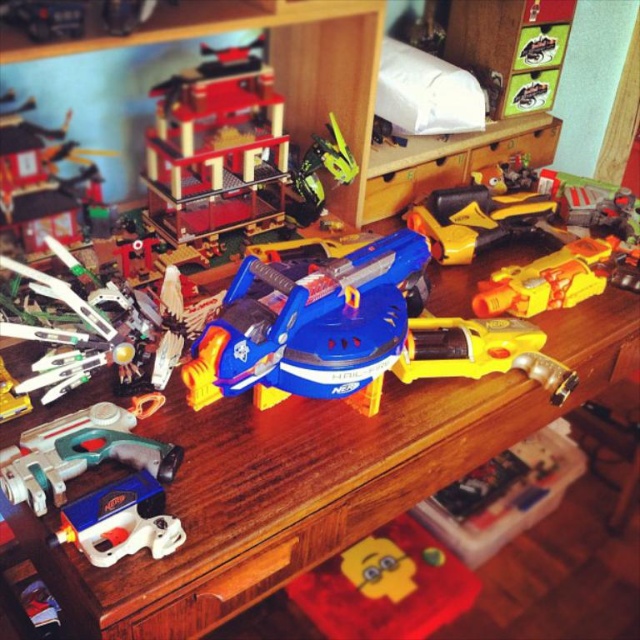
Does wooden table at center have a larger size compared to yellow plastic toy gun at center-right?

Yes, wooden table at center is bigger than yellow plastic toy gun at center-right.

Is wooden table at center shorter than yellow plastic toy gun at center-right?

In fact, wooden table at center may be taller than yellow plastic toy gun at center-right.

From the picture: Measure the distance between wooden table at center and camera.

wooden table at center is 28.72 inches from camera.

Find the location of `wooden table at center`. wooden table at center is located at coordinates (282, 496).

Is point (513, 390) positioned behind point (292, 384)?

Yes, point (513, 390) is farther from viewer.

Which of these two, wooden table at center or blue plastic toy car at center, stands taller?

With more height is wooden table at center.

Is point (570, 342) closer to camera compared to point (381, 291)?

That is False.

The height and width of the screenshot is (640, 640). In order to click on wooden table at center in this screenshot , I will do `click(282, 496)`.

From the picture: Which is below, blue plastic toy car at center or green plastic drill at lower left?

green plastic drill at lower left

Who is more forward, (x=330, y=289) or (x=96, y=436)?

Point (x=96, y=436) is more forward.

Is point (321, 301) closer to camera compared to point (33, 476)?

No, it is not.

Image resolution: width=640 pixels, height=640 pixels. I want to click on blue plastic toy car at center, so click(x=310, y=324).